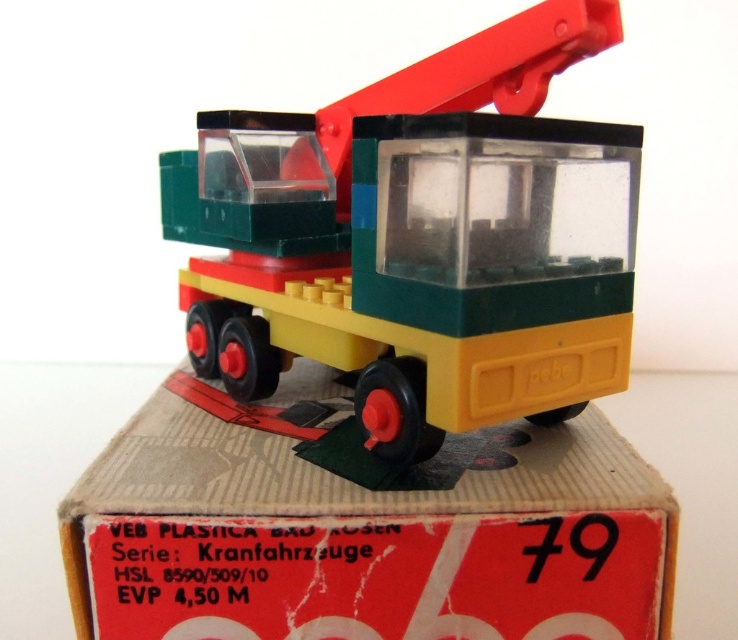
Question: Is yellow matte truck at center closer to the viewer compared to yellow plastic box at center?

Choices:
 (A) yes
 (B) no

Answer: (A)

Question: Is yellow matte truck at center thinner than yellow plastic box at center?

Choices:
 (A) no
 (B) yes

Answer: (B)

Question: Is yellow matte truck at center smaller than yellow plastic box at center?

Choices:
 (A) yes
 (B) no

Answer: (B)

Question: Among these points, which one is nearest to the camera?

Choices:
 (A) (246, 612)
 (B) (325, 248)

Answer: (A)

Question: Among these objects, which one is nearest to the camera?

Choices:
 (A) yellow matte truck at center
 (B) yellow plastic box at center

Answer: (A)